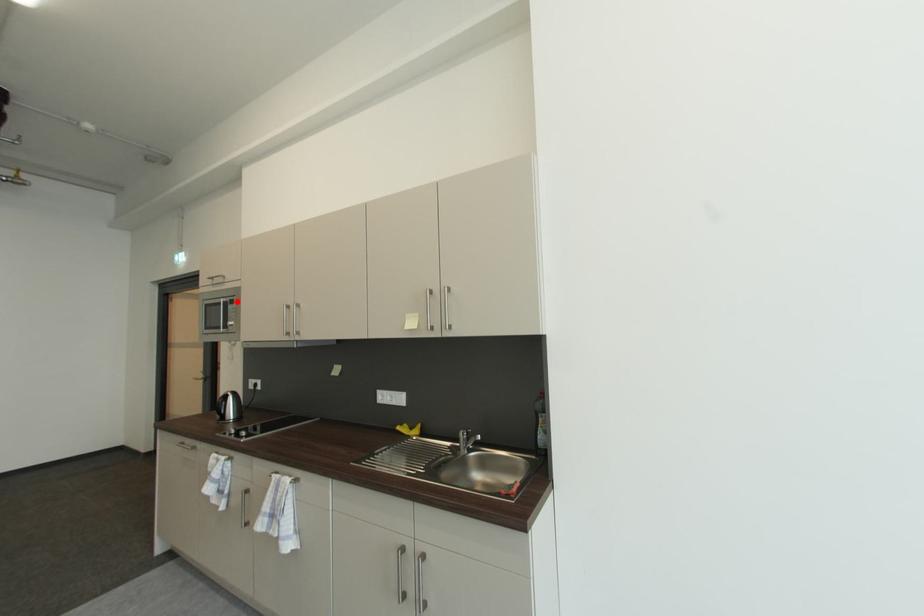
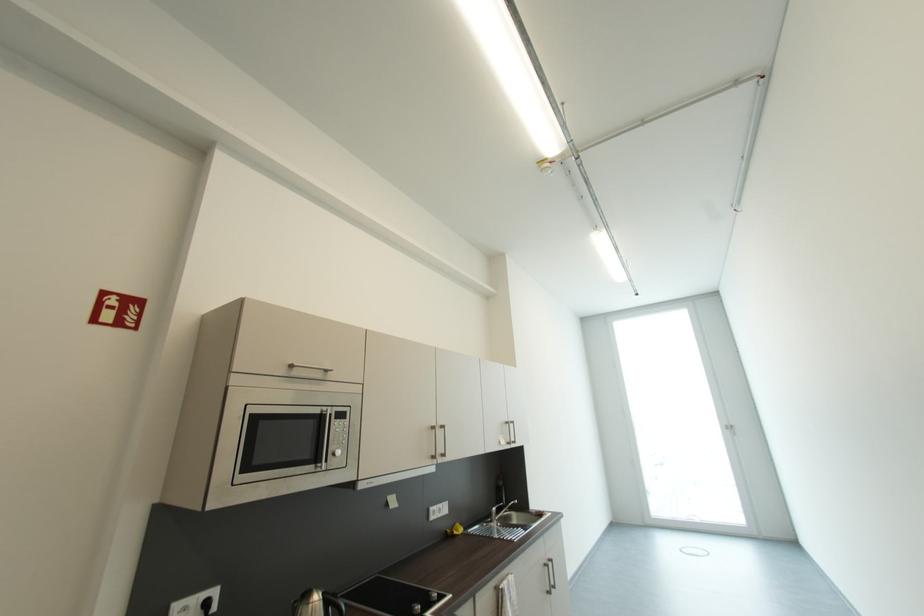
Find the pixel in the second image that matches the highlighted location in the first image.

(342, 413)